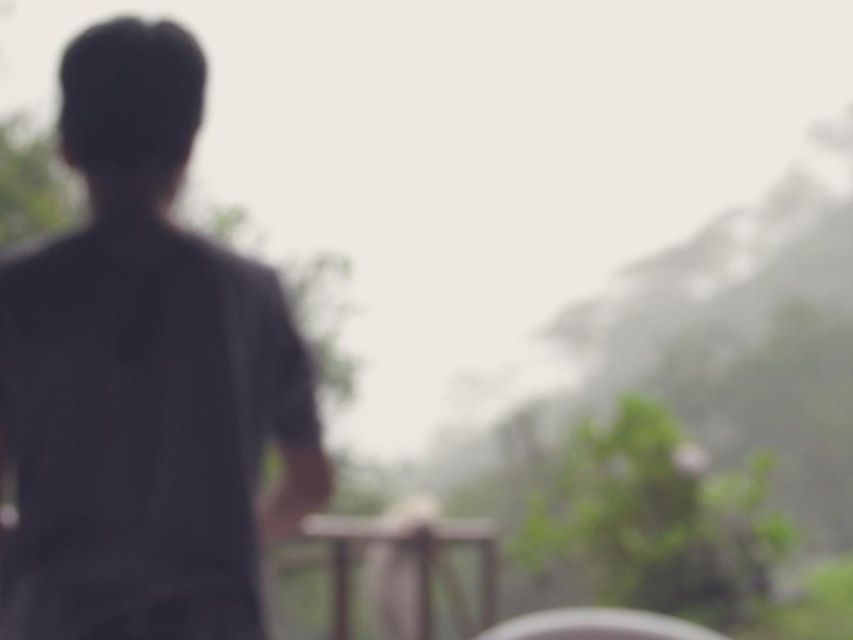
Question: Which of the following is the farthest from the observer?

Choices:
 (A) dark gray shirt at left
 (B) wooden at center

Answer: (B)

Question: Is the position of dark gray shirt at left more distant than that of wooden at center?

Choices:
 (A) no
 (B) yes

Answer: (A)

Question: Does dark gray shirt at left appear on the left side of wooden at center?

Choices:
 (A) yes
 (B) no

Answer: (A)

Question: Among these points, which one is nearest to the camera?

Choices:
 (A) (345, 540)
 (B) (148, 369)

Answer: (B)

Question: Is dark gray shirt at left wider than wooden at center?

Choices:
 (A) yes
 (B) no

Answer: (B)

Question: Which of the following is the closest to the observer?

Choices:
 (A) (113, 604)
 (B) (392, 529)

Answer: (A)